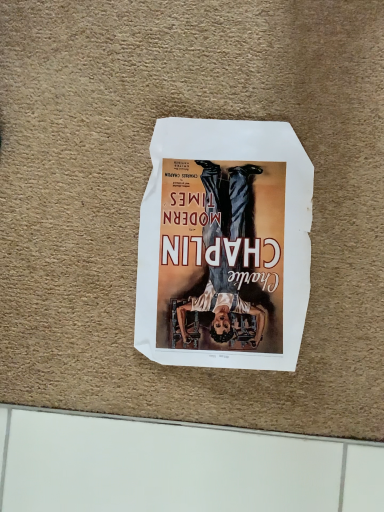
What do you see at coordinates (224, 245) in the screenshot? This screenshot has height=512, width=384. I see `matte paper poster at center` at bounding box center [224, 245].

Measure the distance between point (173, 348) and camera.

Point (173, 348) and camera are 19.61 inches apart from each other.

This screenshot has width=384, height=512. In order to click on matte paper poster at center in this screenshot , I will do `click(224, 245)`.

The image size is (384, 512). Find the location of `matte paper poster at center`. matte paper poster at center is located at coordinates (224, 245).